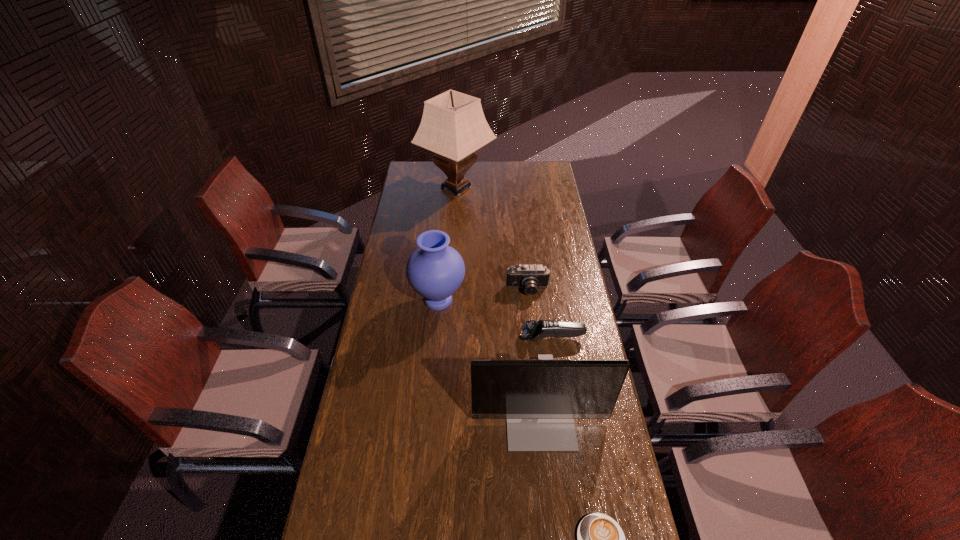
Where is `unoccupied position between the fifth farthest object and the vase`? unoccupied position between the fifth farthest object and the vase is located at coordinates (490, 360).

I want to click on object that is the fourth closest to the vase, so click(453, 125).

You are a GUI agent. You are given a task and a screenshot of the screen. Output one action in this format:
    pyautogui.click(x=<x>, y=<y>)
    Task: Click on the object that stands as the fourth closest to the vase
    
    Given the screenshot: What is the action you would take?
    pyautogui.click(x=453, y=125)